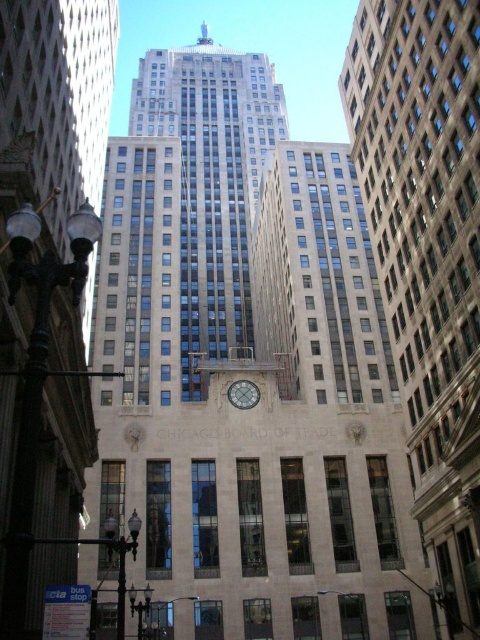
You are an architect visiting the Chicago Board of Trade building. You notice two clocks on the building facade. Which clock is positioned higher up on the building between the polished stone clock tower at center and the silver metallic clock at center?

The polished stone clock tower at center is positioned higher up on the building than the silver metallic clock at center.

You are standing at the Chicago Board of Trade building and want to take a photo of both the inscription and the clock. The inscription is at point (33, 592) and the clock is at point (242, 394). Since you can only focus on one point at a time, which point should you focus on first to ensure the inscription is in the foreground?

You should focus on point (33, 592) first because it is in front of point (242, 394), so focusing on it will keep the inscription in the foreground while the clock will naturally be in the background.

You are an architect analyzing the Chicago Board of Trade building. You notice two central features labeled as the beige stone clock tower at center and the silver metallic clock at center. Which one is closer to the viewer?

The beige stone clock tower at center is closer to the viewer as it is positioned in front of the silver metallic clock at center.